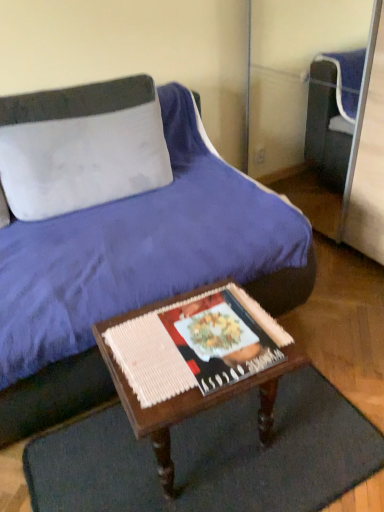
Identify the location of velvet blue bed at center. (178, 232).

What do you see at coordinates (199, 372) in the screenshot? I see `wooden table at center` at bounding box center [199, 372].

Image resolution: width=384 pixels, height=512 pixels. Find the location of `velvet blue bed at center`. velvet blue bed at center is located at coordinates (178, 232).

Choose the correct answer: Is matte paper magazine at center inside dark brown woven mat at lower center or outside it?

matte paper magazine at center is not inside dark brown woven mat at lower center, it's outside.

What's the angular difference between matte paper magazine at center and dark brown woven mat at lower center's facing directions?

matte paper magazine at center and dark brown woven mat at lower center are facing 2.65 degrees away from each other.

From a real-world perspective, between matte paper magazine at center and dark brown woven mat at lower center, who is vertically higher?

matte paper magazine at center.

Are matte paper magazine at center and dark brown woven mat at lower center far apart?

No, there isn't a large distance between matte paper magazine at center and dark brown woven mat at lower center.

Is dark brown woven mat at lower center to the right of wooden table at center from the viewer's perspective?

Yes, dark brown woven mat at lower center is to the right of wooden table at center.

From the image's perspective, is dark brown woven mat at lower center above or below wooden table at center?

dark brown woven mat at lower center is below wooden table at center.

From the picture: In terms of size, does dark brown woven mat at lower center appear bigger or smaller than wooden table at center?

Considering their sizes, dark brown woven mat at lower center takes up less space than wooden table at center.

From their relative heights in the image, would you say dark brown woven mat at lower center is taller or shorter than wooden table at center?

Considering their sizes, dark brown woven mat at lower center has less height than wooden table at center.

Is white fabric pillow at upper left oriented away from dark brown woven mat at lower center?

No, white fabric pillow at upper left's orientation is not away from dark brown woven mat at lower center.

Would you say white fabric pillow at upper left is inside or outside dark brown woven mat at lower center?

white fabric pillow at upper left exists outside the volume of dark brown woven mat at lower center.

Can you confirm if white fabric pillow at upper left is smaller than dark brown woven mat at lower center?

Actually, white fabric pillow at upper left might be larger than dark brown woven mat at lower center.

From the picture: From a real-world perspective, is white fabric pillow at upper left on dark brown woven mat at lower center?

Correct, in the physical world, white fabric pillow at upper left is higher than dark brown woven mat at lower center.

Which of these two, velvet blue bed at center or matte paper magazine at center, is smaller?

matte paper magazine at center is smaller.

Which is behind, point (267, 209) or point (257, 343)?

Point (267, 209)

From the image's perspective, between velvet blue bed at center and matte paper magazine at center, which one is located above?

velvet blue bed at center is shown above in the image.

From a real-world perspective, which is physically above, velvet blue bed at center or matte paper magazine at center?

velvet blue bed at center.

From a real-world perspective, is dark brown woven mat at lower center beneath white fabric pillow at upper left?

Yes.

Between point (121, 420) and point (44, 158), which one is positioned in front?

The point (121, 420) is closer to the camera.

Consider the image. Who is smaller, dark brown woven mat at lower center or white fabric pillow at upper left?

dark brown woven mat at lower center is smaller.

Is dark brown woven mat at lower center wider than white fabric pillow at upper left?

Yes.

Who is smaller, wooden table at center or dark brown woven mat at lower center?

dark brown woven mat at lower center.

Does wooden table at center have a lesser width compared to dark brown woven mat at lower center?

Yes.

You are a GUI agent. You are given a task and a screenshot of the screen. Output one action in this format:
    pyautogui.click(x=<x>, y=<y>)
    Task: Click on the table that appears above the dark brown woven mat at lower center (from the image's perspective)
    
    Given the screenshot: What is the action you would take?
    pyautogui.click(x=199, y=372)

Is dark brown woven mat at lower center located within wooden table at center?

No, dark brown woven mat at lower center is not inside wooden table at center.

Considering the sizes of objects velvet blue bed at center and wooden table at center in the image provided, who is thinner, velvet blue bed at center or wooden table at center?

wooden table at center is thinner.

Is velvet blue bed at center at the right side of wooden table at center?

Incorrect, velvet blue bed at center is not on the right side of wooden table at center.

In the scene shown: Is velvet blue bed at center in contact with wooden table at center?

No, velvet blue bed at center is not making contact with wooden table at center.

Image resolution: width=384 pixels, height=512 pixels. What are the coordinates of `magazine above the dark brown woven mat at lower center (from the image's perspective)` in the screenshot? It's located at (224, 337).

This screenshot has width=384, height=512. What are the coordinates of `doormat behind the wooden table at center` in the screenshot? It's located at (212, 457).

Looking at this image, considering their positions, is velvet blue bed at center positioned closer to dark brown woven mat at lower center than wooden table at center?

The object closer to dark brown woven mat at lower center is wooden table at center.

Estimate the real-world distances between objects in this image. Which object is further from dark brown woven mat at lower center, wooden table at center or white fabric pillow at upper left?

The object further to dark brown woven mat at lower center is white fabric pillow at upper left.

Based on the photo, which object lies nearer to the anchor point white fabric pillow at upper left, velvet blue bed at center or wooden table at center?

velvet blue bed at center is positioned closer to the anchor white fabric pillow at upper left.

When comparing their distances from velvet blue bed at center, does dark brown woven mat at lower center or white fabric pillow at upper left seem further?

dark brown woven mat at lower center is positioned further to the anchor velvet blue bed at center.

Which object lies further to the anchor point white fabric pillow at upper left, velvet blue bed at center or dark brown woven mat at lower center?

The object further to white fabric pillow at upper left is dark brown woven mat at lower center.

When comparing their distances from white fabric pillow at upper left, does matte paper magazine at center or wooden table at center seem closer?

Based on the image, wooden table at center appears to be nearer to white fabric pillow at upper left.

Which object lies further to the anchor point velvet blue bed at center, matte paper magazine at center or white fabric pillow at upper left?

matte paper magazine at center lies further to velvet blue bed at center than the other object.

When comparing their distances from matte paper magazine at center, does wooden table at center or dark brown woven mat at lower center seem further?

Based on the image, dark brown woven mat at lower center appears to be further to matte paper magazine at center.

Locate an element on the screen. The image size is (384, 512). magazine that lies between white fabric pillow at upper left and wooden table at center from top to bottom is located at coordinates (224, 337).

Identify the location of table between matte paper magazine at center and dark brown woven mat at lower center in the vertical direction. The width and height of the screenshot is (384, 512). (199, 372).

Find the location of `bed between white fabric pillow at upper left and wooden table at center from top to bottom`. bed between white fabric pillow at upper left and wooden table at center from top to bottom is located at coordinates (178, 232).

The image size is (384, 512). I want to click on magazine between velvet blue bed at center and wooden table at center vertically, so click(x=224, y=337).